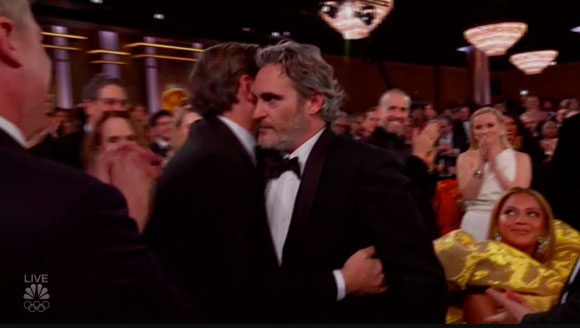
Image resolution: width=580 pixels, height=328 pixels. Identify the location of brown back wall. (83, 65), (166, 68), (361, 81), (414, 77), (451, 84), (551, 83).